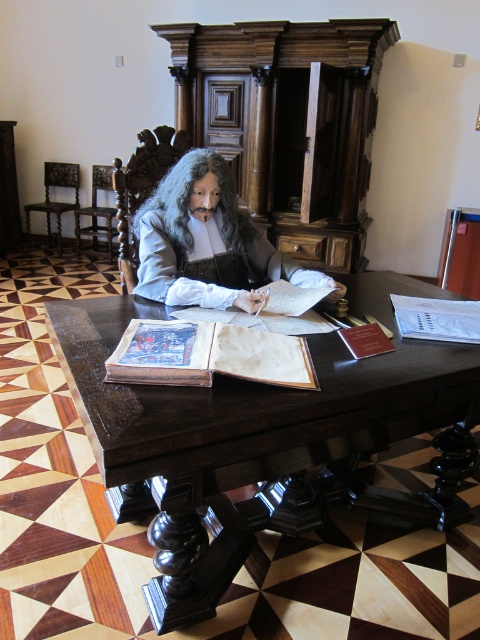
Who is more distant from viewer, (395, 310) or (60, 172)?

The point (60, 172) is behind.

Can you confirm if white paper book at center is smaller than dark wood chair at left?

Correct, white paper book at center occupies less space than dark wood chair at left.

At what (x,y) coordinates should I click in order to perform the action: click on white paper book at center. Please return your answer as a coordinate pair (x, y). Looking at the image, I should click on (436, 317).

Is matte leather book at center to the left of grayhair at center from the viewer's perspective?

In fact, matte leather book at center is to the right of grayhair at center.

Which is in front, point (146, 321) or point (245, 230)?

Point (146, 321) is in front.

Identify the location of matte leather book at center. Image resolution: width=480 pixels, height=640 pixels. (207, 355).

Between white paper book at center and wooden chair at center, which one is positioned higher?

wooden chair at center

Is white paper book at center to the right of wooden chair at center from the viewer's perspective?

Indeed, white paper book at center is positioned on the right side of wooden chair at center.

Is point (398, 310) in front of point (75, 240)?

Yes, point (398, 310) is in front of point (75, 240).

Where is `white paper book at center`? white paper book at center is located at coordinates (436, 317).